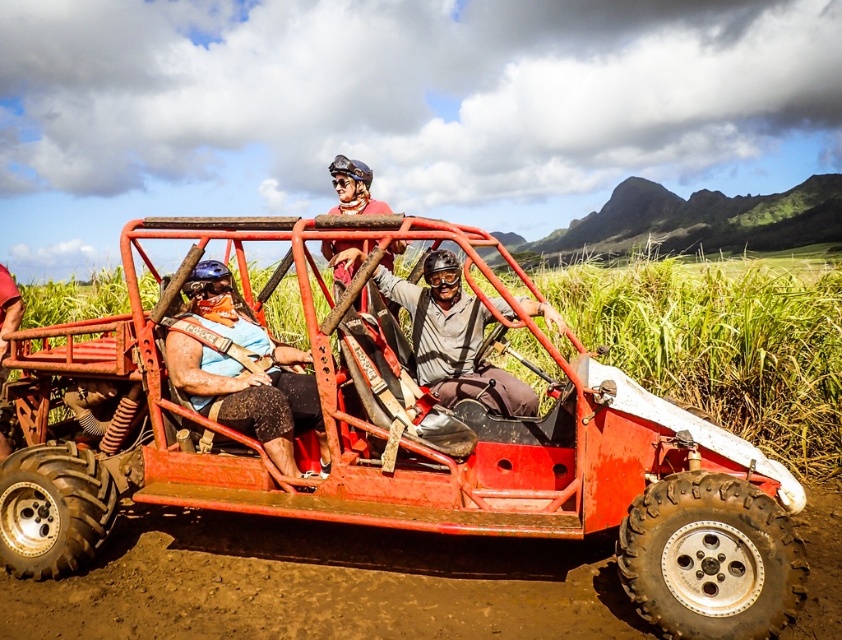
Is matte blue helmet at center taller than matte black helmet at left?

Yes.

Between matte blue helmet at center and matte black helmet at left, which one appears on the right side from the viewer's perspective?

matte blue helmet at center

Measure the distance between matte blue helmet at center and camera.

The distance of matte blue helmet at center from camera is 4.06 meters.

Find the location of `matte blue helmet at center`. matte blue helmet at center is located at coordinates (242, 371).

Which is more to the left, matte black helmet at center or matte black helmet at left?

matte black helmet at left

Is matte black helmet at center to the left of matte black helmet at left from the viewer's perspective?

Incorrect, matte black helmet at center is not on the left side of matte black helmet at left.

Measure the distance between matte black helmet at center and camera.

matte black helmet at center and camera are 4.45 meters apart from each other.

Where is `matte black helmet at center`? Image resolution: width=842 pixels, height=640 pixels. matte black helmet at center is located at coordinates (453, 339).

Is metallic red jeep at center below matte black helmet at center?

Correct, metallic red jeep at center is located below matte black helmet at center.

In the scene shown: How much distance is there between metallic red jeep at center and matte black helmet at center?

metallic red jeep at center is 96.09 centimeters from matte black helmet at center.

Which is behind, point (619, 464) or point (388, 280)?

Point (388, 280)

Locate an element on the screen. metallic red jeep at center is located at coordinates (384, 444).